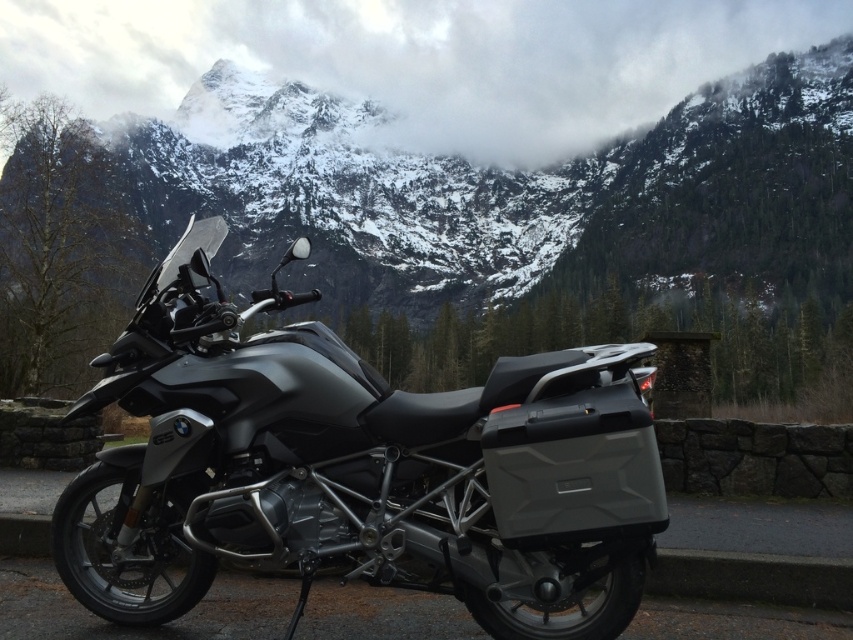
You are a photographer planning to take a photo of the matte black motorcycle at center and the snowy granite mountain at center. Based on their positions, which object would appear closer to the camera in the final image?

The matte black motorcycle at center appears closer to the camera than the snowy granite mountain at center because it is positioned below it, indicating that the mountain is in the background.

Consider the image. You are a photographer planning to capture the snowy granite mountain at center and the black rubber curb at lower left in a single frame. Based on their sizes, which object would appear larger in the photo?

The snowy granite mountain at center would appear larger in the photo because it is bigger than the black rubber curb at lower left.